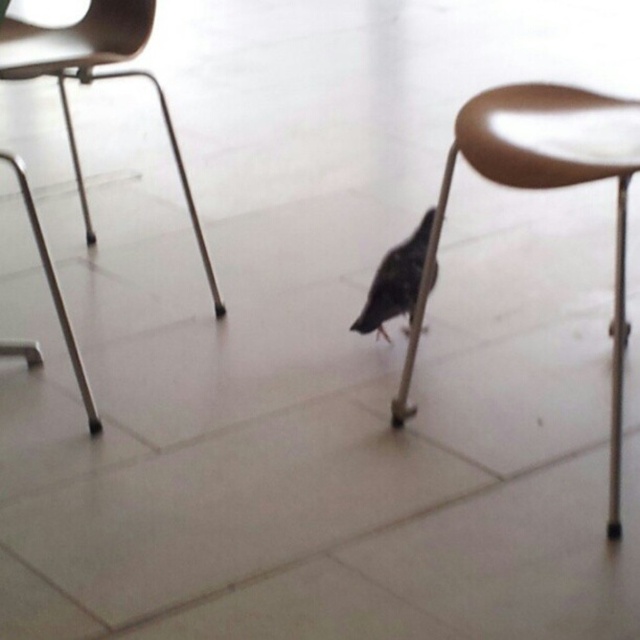
Question: Among these objects, which one is farthest from the camera?

Choices:
 (A) matte brown stool at center
 (B) dark gray matte bird at center
 (C) matte wood chair at left

Answer: (C)

Question: Can you confirm if matte brown stool at center is positioned to the right of matte wood chair at left?

Choices:
 (A) yes
 (B) no

Answer: (A)

Question: Estimate the real-world distances between objects in this image. Which object is closer to the matte wood chair at left?

Choices:
 (A) matte brown stool at center
 (B) dark gray matte bird at center

Answer: (B)

Question: Can you confirm if matte brown stool at center is thinner than dark gray matte bird at center?

Choices:
 (A) no
 (B) yes

Answer: (A)

Question: Observing the image, what is the correct spatial positioning of matte wood chair at left in reference to dark gray matte bird at center?

Choices:
 (A) above
 (B) below

Answer: (A)

Question: Estimate the real-world distances between objects in this image. Which object is closer to the dark gray matte bird at center?

Choices:
 (A) matte brown stool at center
 (B) matte wood chair at left

Answer: (A)